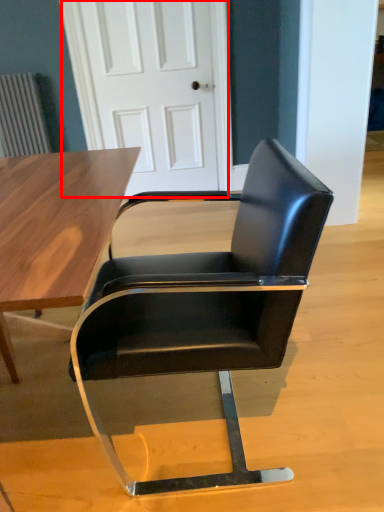
Question: From the image's perspective, what is the correct spatial positioning of door (annotated by the red box) in reference to chair?

Choices:
 (A) below
 (B) above

Answer: (B)